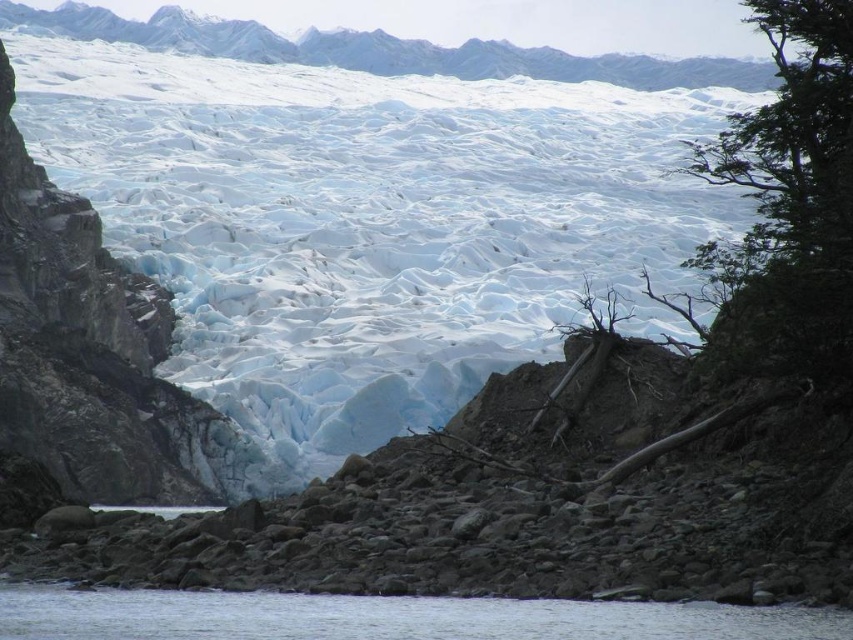
Question: Is clear water at lower center in front of white ice mountain at upper center?

Choices:
 (A) no
 (B) yes

Answer: (B)

Question: Among these points, which one is nearest to the camera?

Choices:
 (A) [x=341, y=42]
 (B) [x=155, y=620]

Answer: (B)

Question: Which of the following is the farthest from the observer?

Choices:
 (A) (190, 32)
 (B) (335, 602)

Answer: (A)

Question: Can you confirm if clear water at lower center is thinner than white ice mountain at upper center?

Choices:
 (A) no
 (B) yes

Answer: (B)

Question: In this image, where is clear water at lower center located relative to white ice mountain at upper center?

Choices:
 (A) right
 (B) left

Answer: (A)